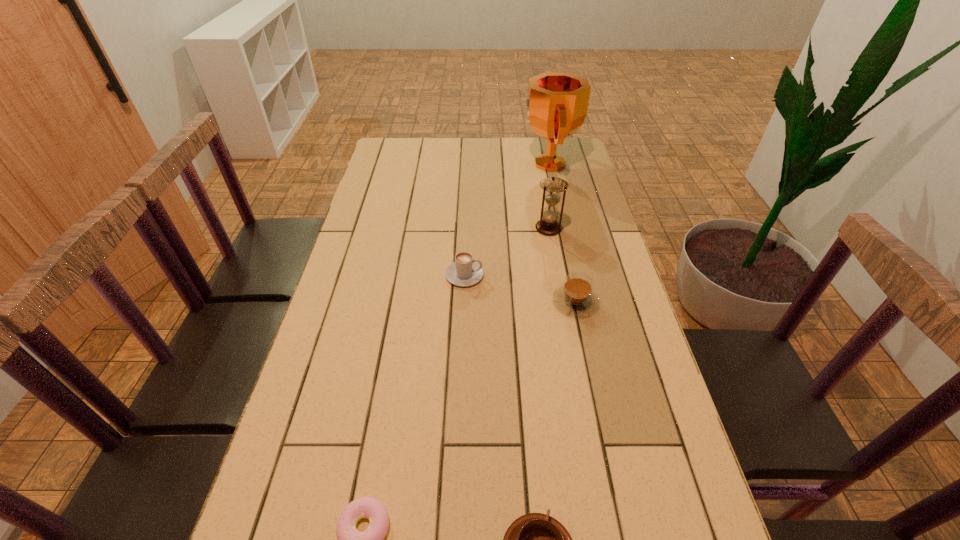
You are a GUI agent. You are given a task and a screenshot of the screen. Output one action in this format:
    pyautogui.click(x=<x>, y=<y>)
    Task: Click on the cappuccino identified as the second closest to the tallest object
    
    Given the screenshot: What is the action you would take?
    pyautogui.click(x=575, y=297)

This screenshot has height=540, width=960. Find the location of `vacant space that satisfies the following two spatial constraints: 1. on the front side of the fifth shortest object; 2. to the right of the leftmost cappuccino`. vacant space that satisfies the following two spatial constraints: 1. on the front side of the fifth shortest object; 2. to the right of the leftmost cappuccino is located at coordinates (557, 275).

Locate an element on the screen. The image size is (960, 540). vacant area in the image that satisfies the following two spatial constraints: 1. on the side of the tallest object with the star emblem; 2. on the front side of the hourglass is located at coordinates (563, 228).

The height and width of the screenshot is (540, 960). I want to click on vacant space that satisfies the following two spatial constraints: 1. on the side of the farthest object with the star emblem; 2. on the front side of the fifth shortest object, so click(x=563, y=228).

The width and height of the screenshot is (960, 540). Find the location of `vacant position in the image that satisfies the following two spatial constraints: 1. on the front side of the hourglass; 2. on the left side of the rightmost cappuccino`. vacant position in the image that satisfies the following two spatial constraints: 1. on the front side of the hourglass; 2. on the left side of the rightmost cappuccino is located at coordinates (562, 301).